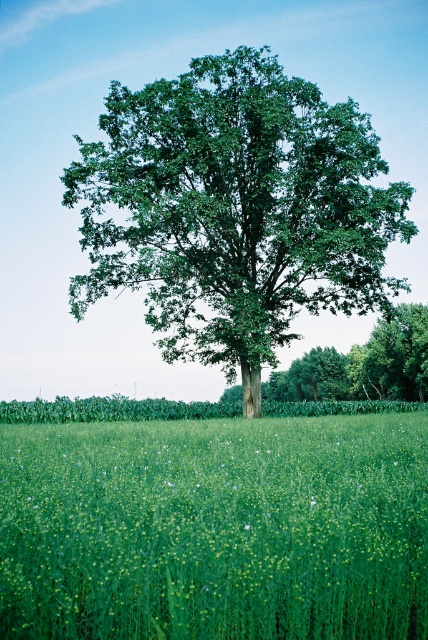
Who is lower down, green grass at center or green leafy oak tree at center?

green grass at center is below.

Between green grass at center and green leafy oak tree at center, which one is positioned higher?

Positioned higher is green leafy oak tree at center.

Who is more distant from viewer, (335, 506) or (225, 125)?

The point (225, 125) is more distant.

At what (x,y) coordinates should I click in order to perform the action: click on green grass at center. Please return your answer as a coordinate pair (x, y). Looking at the image, I should click on (216, 529).

Can you confirm if green leafy oak tree at center is positioned above green leafy tree at center?

Indeed, green leafy oak tree at center is positioned over green leafy tree at center.

Is the position of green leafy oak tree at center more distant than that of green leafy tree at center?

No, it is in front of green leafy tree at center.

Between point (219, 216) and point (320, 397), which one is positioned in front?

Point (219, 216) is in front.

At what (x,y) coordinates should I click in order to perform the action: click on green leafy oak tree at center. Please return your answer as a coordinate pair (x, y). This screenshot has height=640, width=428. Looking at the image, I should click on (234, 211).

Does green grass at center have a lesser width compared to green leafy tree at center?

Result: Yes.

Can you confirm if green grass at center is positioned above green leafy tree at center?

Yes, green grass at center is above green leafy tree at center.

Is point (321, 588) farther from viewer compared to point (392, 372)?

No, it is in front of (392, 372).

This screenshot has width=428, height=640. Identify the location of green grass at center. click(216, 529).